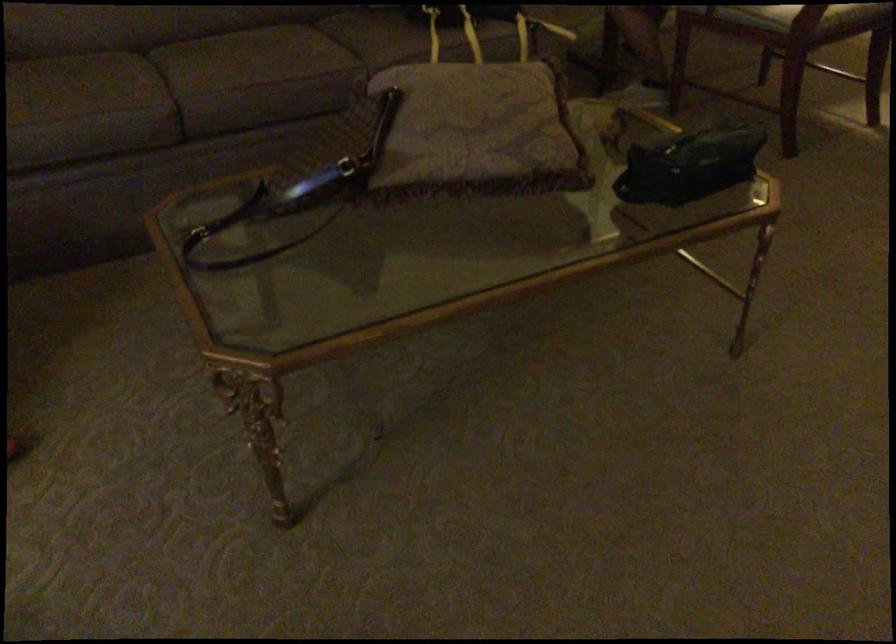
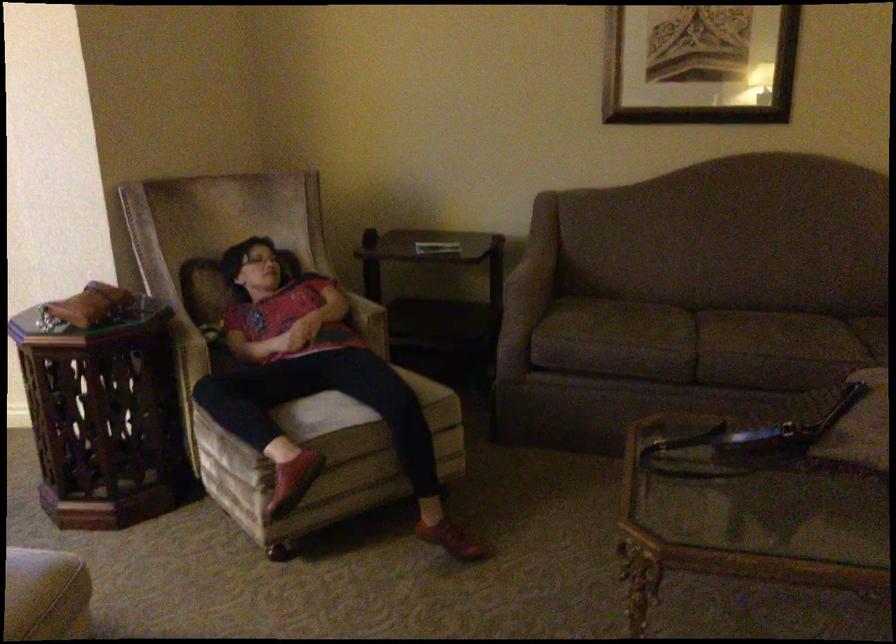
The point at (x=309, y=202) is marked in the first image. Where is the corresponding point in the second image?

(761, 447)